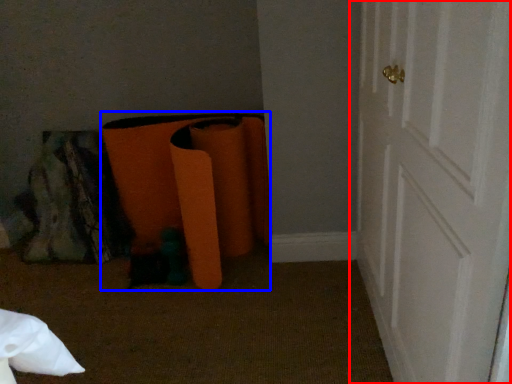
Question: Among these objects, which one is farthest to the camera, door (highlighted by a red box) or bean bag chair (highlighted by a blue box)?

Choices:
 (A) door
 (B) bean bag chair

Answer: (B)